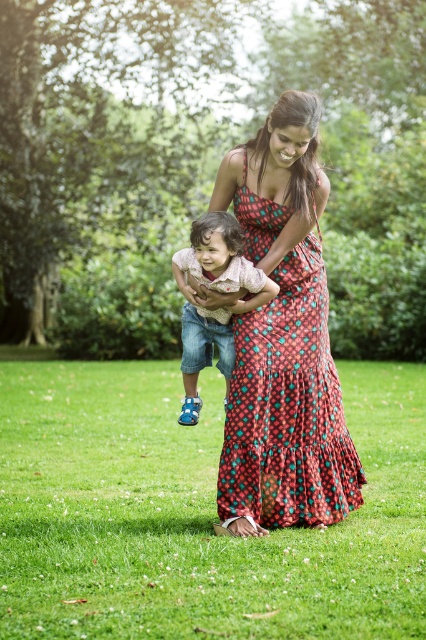
Which of these two, printed cotton dress at center or matte pink shirt at center, stands taller?

printed cotton dress at center is taller.

Can you confirm if printed cotton dress at center is thinner than matte pink shirt at center?

No, printed cotton dress at center is not thinner than matte pink shirt at center.

Is point (221, 468) less distant than point (196, 275)?

Yes.

Find the location of a particular element. This screenshot has width=426, height=640. printed cotton dress at center is located at coordinates (287, 406).

From the picture: Is green grass at center positioned behind matte pink shirt at center?

No, it is in front of matte pink shirt at center.

Does green grass at center have a larger size compared to matte pink shirt at center?

Indeed, green grass at center has a larger size compared to matte pink shirt at center.

Between point (316, 586) and point (192, 353), which one is positioned in front?

Positioned in front is point (316, 586).

The image size is (426, 640). Find the location of `green grass at center`. green grass at center is located at coordinates (195, 515).

Which is more to the right, green grass at center or printed cotton dress at center?

Positioned to the right is printed cotton dress at center.

Between point (180, 541) and point (255, 483), which one is positioned in front?

Positioned in front is point (180, 541).

Is point (117, 394) in front of point (321, 314)?

No, (117, 394) is behind (321, 314).

At what (x,y) coordinates should I click in order to perform the action: click on green grass at center. Please return your answer as a coordinate pair (x, y). The image size is (426, 640). Looking at the image, I should click on (195, 515).